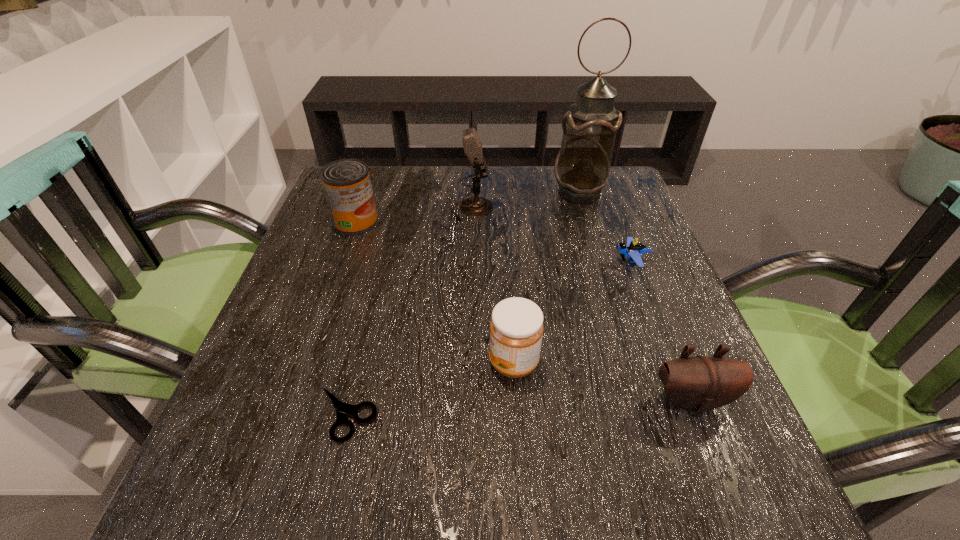
This screenshot has height=540, width=960. Find the location of `oil lamp`. oil lamp is located at coordinates (582, 168).

Locate an element on the screen. the second tallest object is located at coordinates (474, 206).

Locate an element on the screen. can is located at coordinates (346, 183).

Locate an element on the screen. This screenshot has height=540, width=960. jam is located at coordinates (516, 328).

This screenshot has width=960, height=540. In order to click on pouch in this screenshot , I will do `click(697, 384)`.

Find the location of a particular element. The width and height of the screenshot is (960, 540). Lego is located at coordinates (634, 250).

Image resolution: width=960 pixels, height=540 pixels. Find the location of `the fourth farthest object`. the fourth farthest object is located at coordinates (634, 250).

At what (x,y) coordinates should I click in order to perform the action: click on shears. Please return your answer as a coordinate pair (x, y). This screenshot has width=960, height=540. Looking at the image, I should click on [x=342, y=409].

Identify the location of blank space located 0.140m on the left of the oil lamp. This screenshot has height=540, width=960. (497, 192).

Locate an element on the screen. The image size is (960, 540). vacant area situated 0.260m on the front-facing side of the microphone is located at coordinates (599, 209).